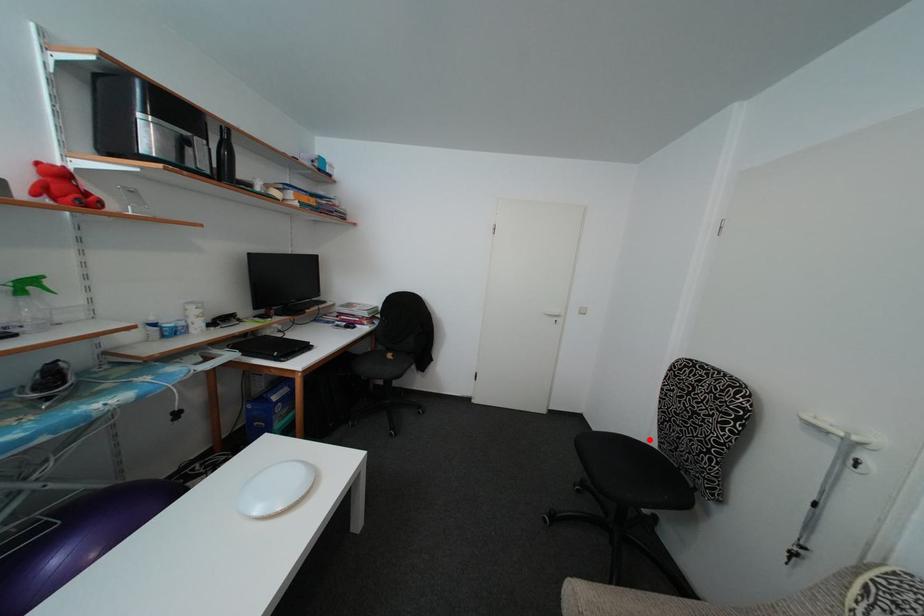
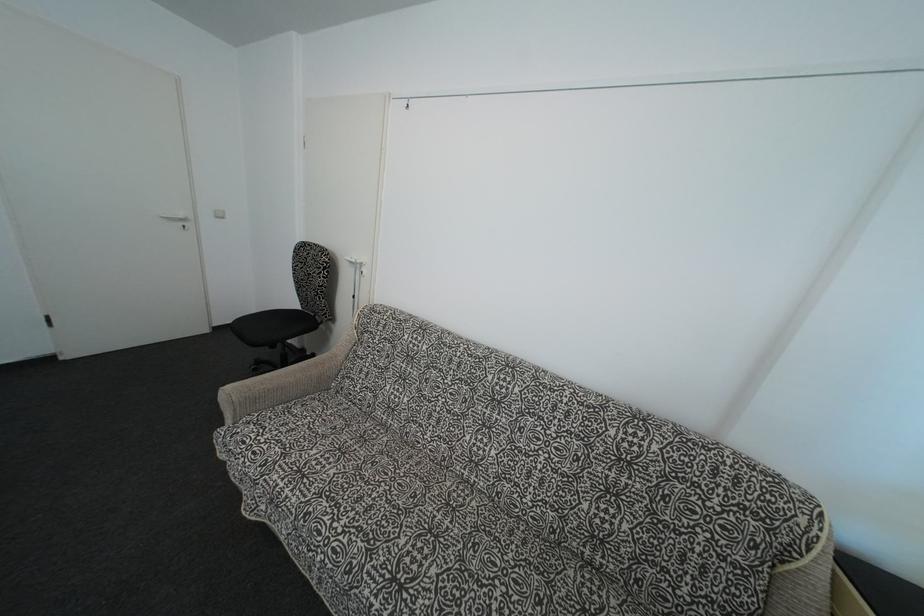
The point at the highlighted location is marked in the first image. Where is the corresponding point in the second image?

(297, 310)